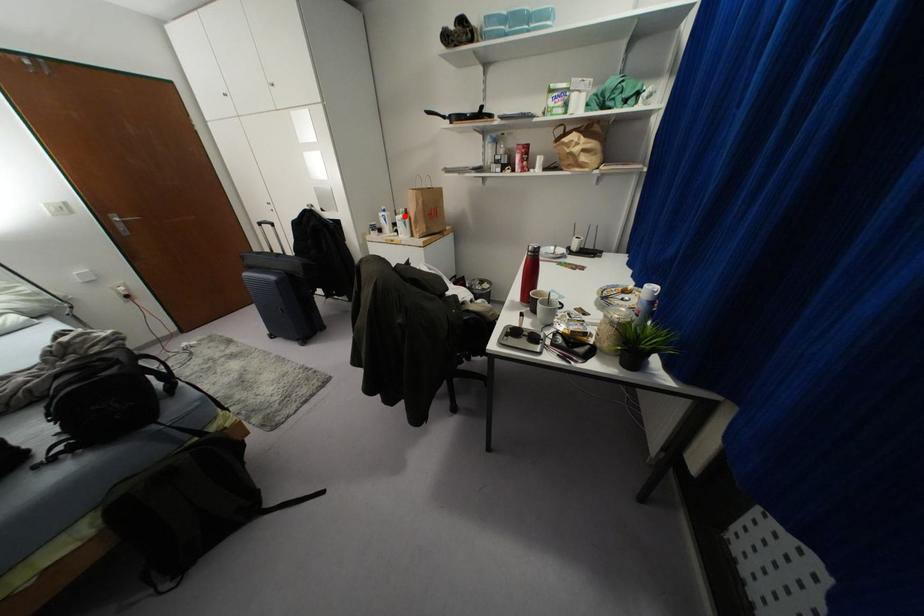
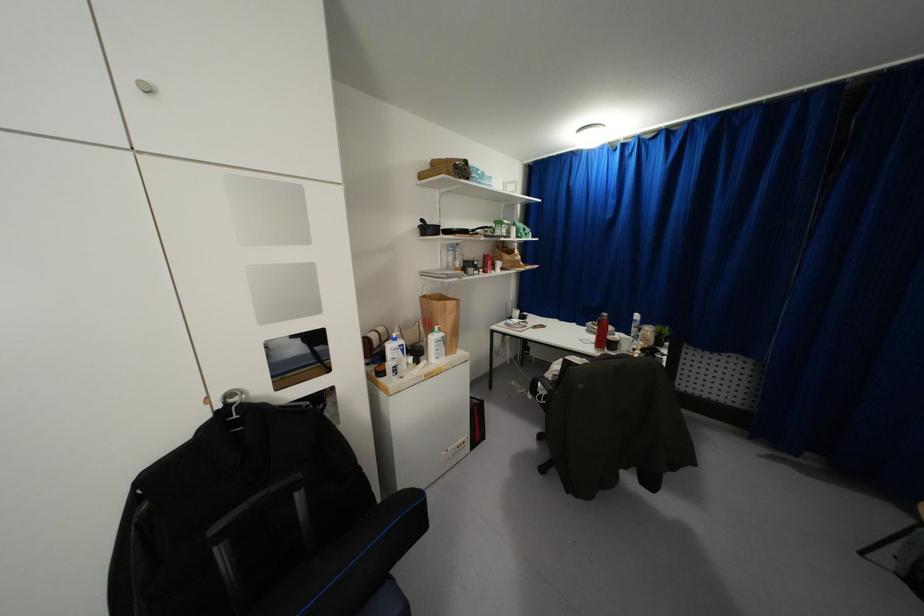
Where in the second image is the point corresponding to the highlighted location from the first image?

(442, 333)